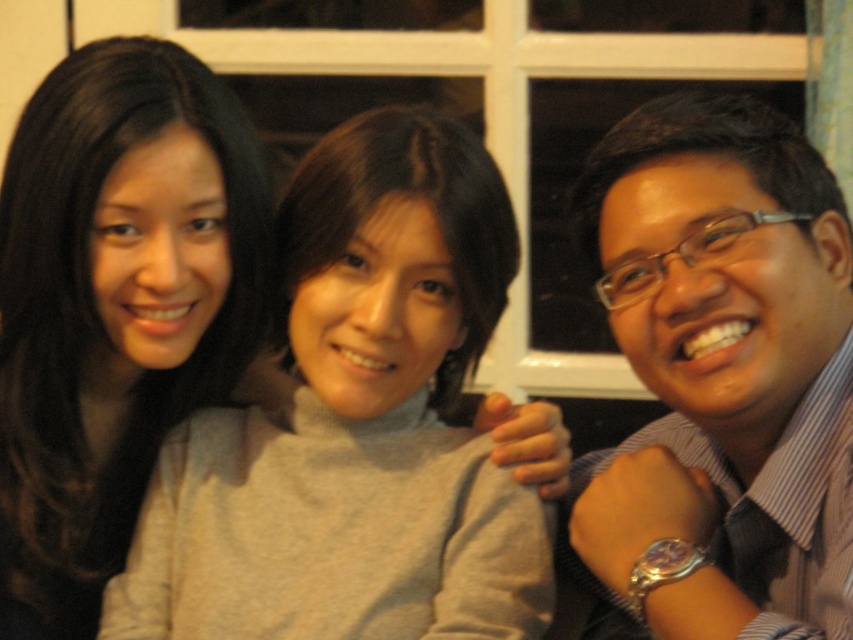
In the scene shown: You are a photographer trying to adjust the lighting for a group photo. You notice the matte black shirt at right and the matte gray sweater at center. Given their proximity, how far apart are these two clothing items?

The matte black shirt at right is 50.08 centimeters from the matte gray sweater at center.

You are standing in the room and want to know the position of the two people wearing the matte black shirt at right and the matte gray sweater at center. Which one is positioned to the right side of the other?

The matte black shirt at right is positioned to the right of the matte gray sweater at center.

In the scene shown: You are a photographer trying to place a small prop at the exact coordinates of point (357, 426) in the image. According to the scene description, which object should you place it on?

The point (357, 426) is on the gray matte sweater at center, so you should place the prop on the gray matte sweater at center.